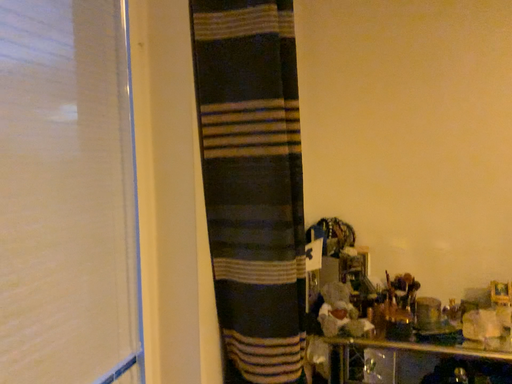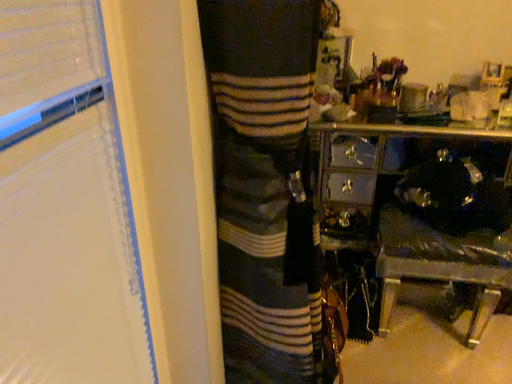
Question: How did the camera likely rotate when shooting the video?

Choices:
 (A) rotated downward
 (B) rotated upward

Answer: (A)